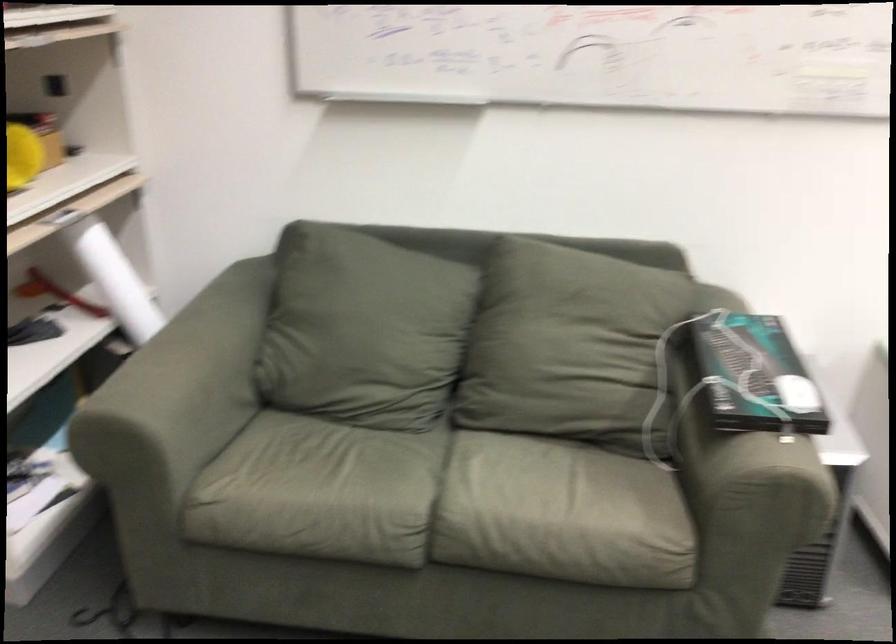
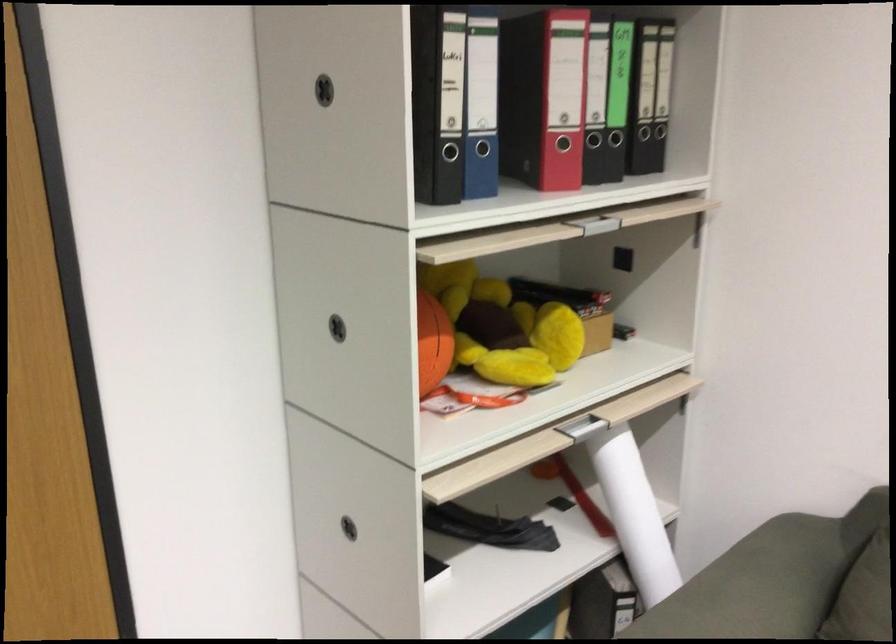
Find the pixel in the second image that matches point (81, 220) in the first image.

(595, 421)